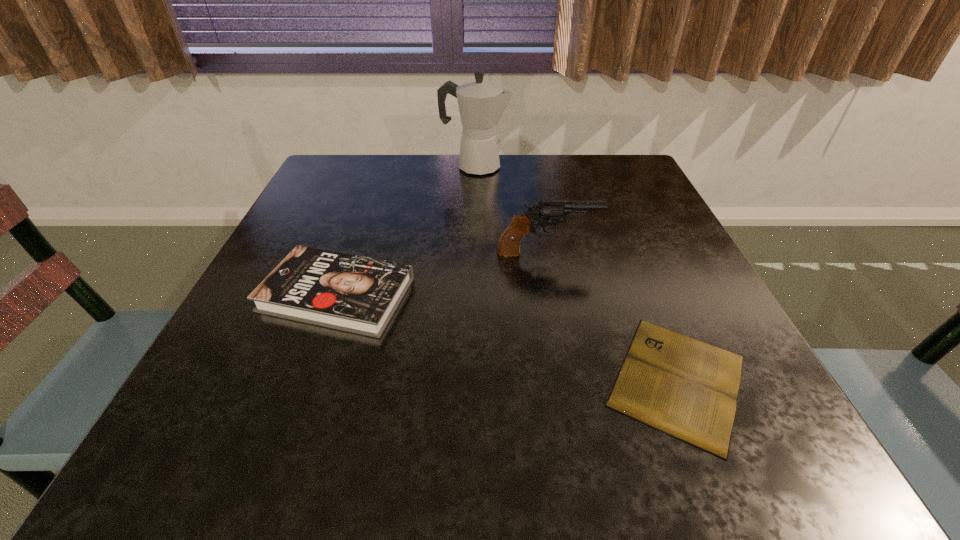
Where is `blank space located 0.330m on the right of the taller book`? blank space located 0.330m on the right of the taller book is located at coordinates (595, 295).

Where is `vacant region located on the back of the right book`? This screenshot has height=540, width=960. vacant region located on the back of the right book is located at coordinates (613, 223).

At what (x,y) coordinates should I click in order to perform the action: click on object present at the far edge. Please return your answer as a coordinate pair (x, y). This screenshot has width=960, height=540. Looking at the image, I should click on (481, 104).

Image resolution: width=960 pixels, height=540 pixels. Find the location of `object positioned at the near edge`. object positioned at the near edge is located at coordinates (686, 388).

Locate an element on the screen. object present at the left edge is located at coordinates (352, 293).

At what (x,y) coordinates should I click in order to perform the action: click on object located at the right edge. Please return your answer as a coordinate pair (x, y). This screenshot has height=540, width=960. Looking at the image, I should click on [686, 388].

Locate an element on the screen. Image resolution: width=960 pixels, height=540 pixels. object present at the near right corner is located at coordinates click(686, 388).

In the image, there is a desktop. Where is `vacant space at the far edge`? vacant space at the far edge is located at coordinates (441, 157).

Find the location of a particular element. blank space at the near edge of the desktop is located at coordinates (534, 452).

You are a GUI agent. You are given a task and a screenshot of the screen. Output one action in this format:
    pyautogui.click(x=<x>, y=<y>)
    Task: Click on the blank space at the left edge of the desktop
    
    Given the screenshot: What is the action you would take?
    pyautogui.click(x=211, y=403)